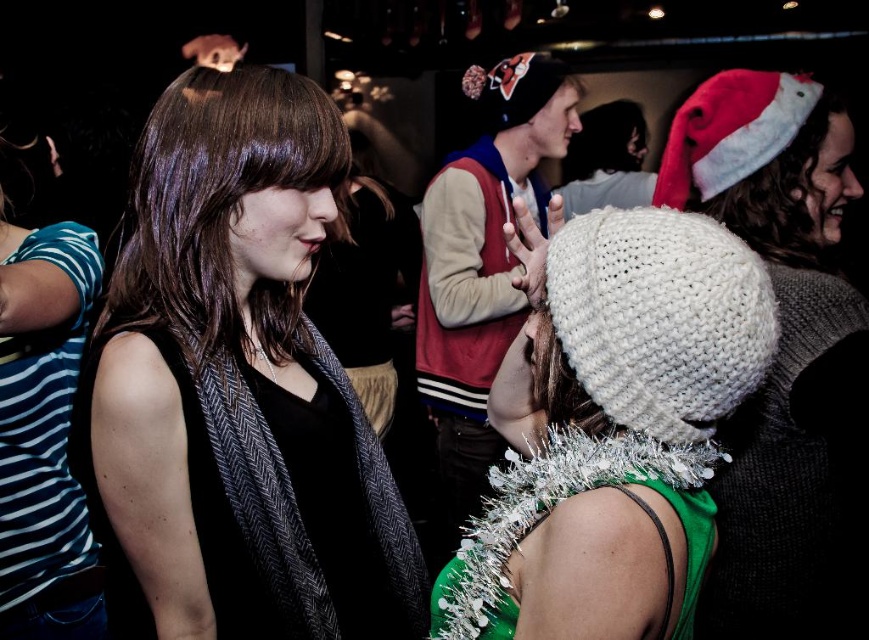
You are a photographer at the event and want to capture a closeup of both the white knitted beanie at center and the shiny brown hair at center in one frame. Which object should you zoom in on to ensure both are visible without cropping?

The white knitted beanie at center is larger in size than the shiny brown hair at center, so you should zoom in on the white knitted beanie at center to ensure both are visible without cropping.

You are at a party and need to find the white knitted beanie at center. Which direction should you look relative to the matte black scarf at left?

The white knitted beanie at center is to the right of the matte black scarf at left.